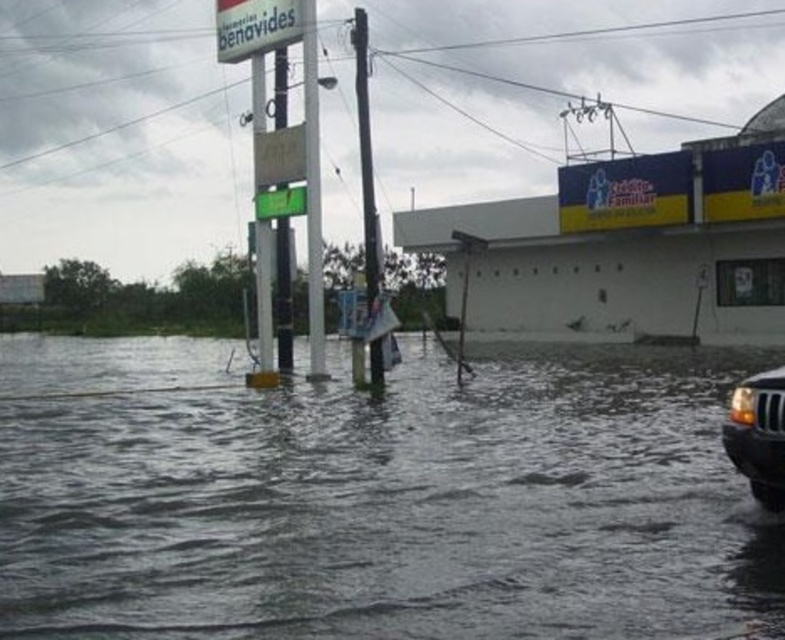
You are a pedestrian trying to cross the flooded street. You see the gray murky water at center and the matte black suv at lower right. Which object is closer to the ground level?

The gray murky water at center is positioned under the matte black suv at lower right, meaning the water is closer to the ground level than the SUV.

You are a pedestrian trying to cross the flooded street. You see the gray murky water at center and the matte black suv at lower right. Which object is closer to you as you approach the flooded area?

The gray murky water at center is in front of the matte black suv at lower right, so the gray murky water at center is closer to you as you approach the flooded area.